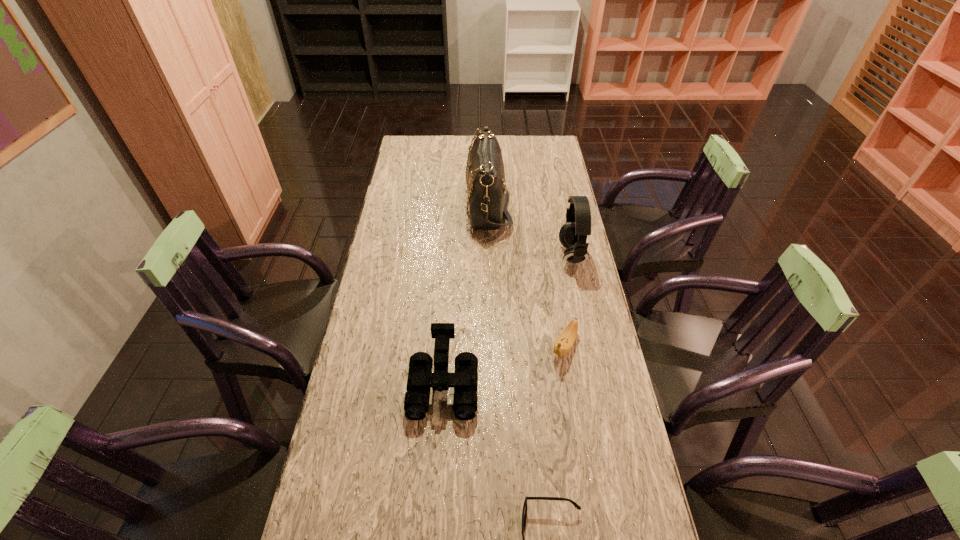
The width and height of the screenshot is (960, 540). What are the coordinates of `free space between the banana and the binoculars` in the screenshot? It's located at (504, 365).

This screenshot has width=960, height=540. What are the coordinates of `free space between the fourth tallest object and the binoculars` in the screenshot? It's located at (504, 365).

Find the location of a particular element. This screenshot has height=540, width=960. blank region between the earphone and the handbag is located at coordinates (530, 230).

This screenshot has height=540, width=960. I want to click on vacant area that lies between the handbag and the binoculars, so click(466, 295).

Locate an element on the screen. The image size is (960, 540). vacant region between the banana and the handbag is located at coordinates (526, 275).

Locate an element on the screen. free space between the handbag and the binoculars is located at coordinates pos(466,295).

Point out which object is positioned as the nearest to the handbag. Please provide its 2D coordinates. Your answer should be formatted as a tuple, i.e. [(x, y)], where the tuple contains the x and y coordinates of a point satisfying the conditions above.

[(573, 234)]

Identify the location of the fourth closest object to the second tallest object. (524, 512).

You are a GUI agent. You are given a task and a screenshot of the screen. Output one action in this format:
    pyautogui.click(x=<x>, y=<y>)
    Task: Click on the blank space that satisfies the following two spatial constraints: 1. on the ear cups of the earphone; 2. on the front lenses of the binoculars
    Image resolution: width=960 pixels, height=540 pixels.
    Given the screenshot: What is the action you would take?
    pyautogui.click(x=599, y=384)

Locate an element on the screen. vacant space that satisfies the following two spatial constraints: 1. on the ear cups of the fourth shortest object; 2. on the front lenses of the third shortest object is located at coordinates (599, 384).